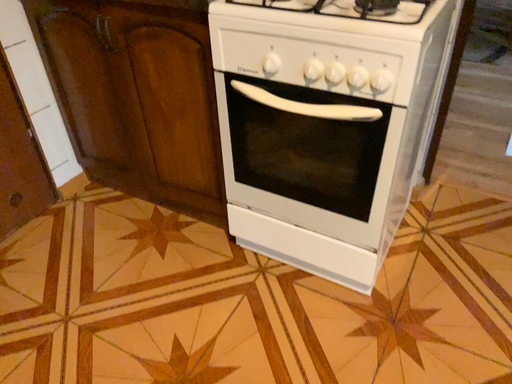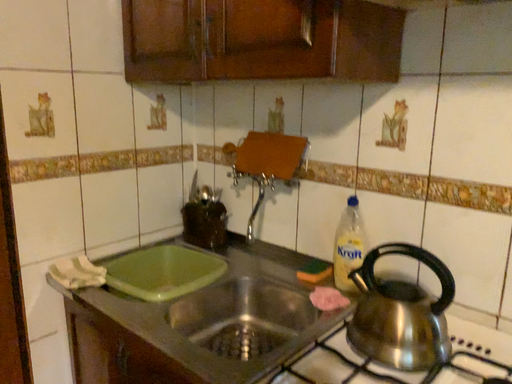
Question: How did the camera likely rotate when shooting the video?

Choices:
 (A) rotated left
 (B) rotated right

Answer: (A)